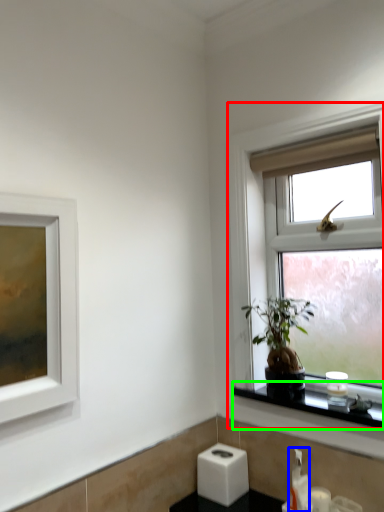
Question: Which object is positioned closest to window (highlighted by a red box)? Select from soap dispenser (highlighted by a blue box) and window sill (highlighted by a green box).

Choices:
 (A) soap dispenser
 (B) window sill

Answer: (B)